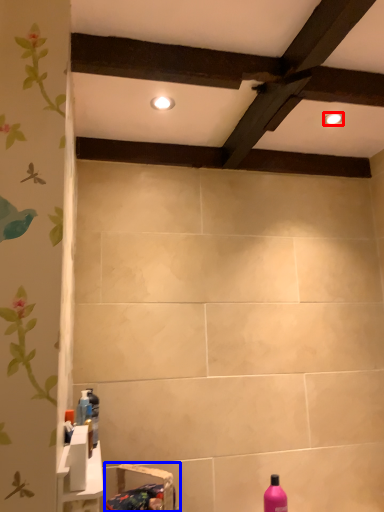
Question: Which of the following is the farthest to the observer, lighting (highlighted by a red box) or sink (highlighted by a blue box)?

Choices:
 (A) lighting
 (B) sink

Answer: (A)